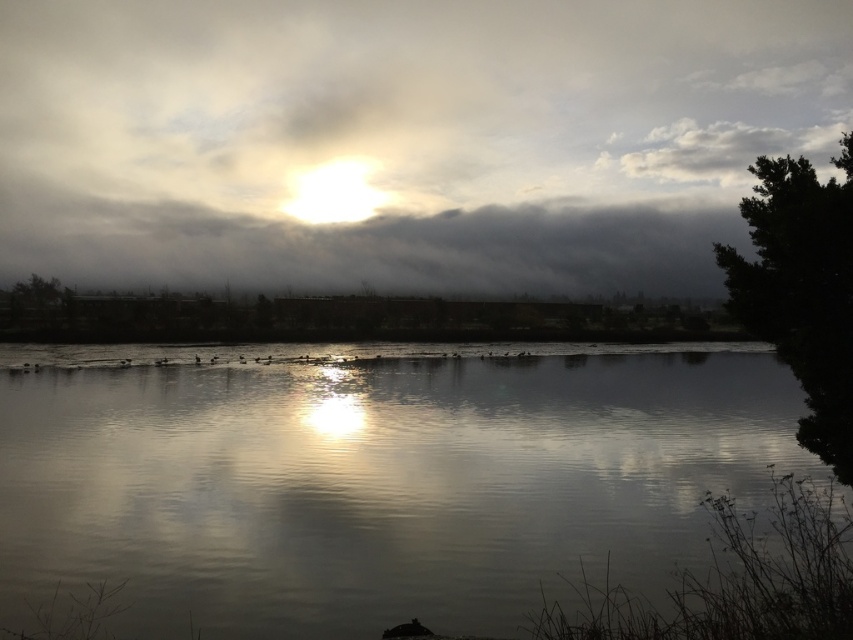
Who is shorter, dark green leafy tree at right or green leafy tree at left?

green leafy tree at left

Between dark green leafy tree at right and green leafy tree at left, which one appears on the left side from the viewer's perspective?

From the viewer's perspective, green leafy tree at left appears more on the left side.

Who is more distant from viewer, [817,280] or [65,305]?

Positioned behind is point [65,305].

Locate an element on the screen. Image resolution: width=853 pixels, height=640 pixels. dark green leafy tree at right is located at coordinates (802, 291).

Who is positioned more to the left, silvery reflective water at center or dark green leafy tree at right?

silvery reflective water at center is more to the left.

Who is shorter, silvery reflective water at center or dark green leafy tree at right?

silvery reflective water at center

I want to click on silvery reflective water at center, so coord(375,480).

Find the location of a particular element. silvery reflective water at center is located at coordinates 375,480.

Between point (88, 32) and point (38, 284), which one is positioned in front?

Point (38, 284)

The height and width of the screenshot is (640, 853). Describe the element at coordinates (403, 138) in the screenshot. I see `cloudy sky at upper center` at that location.

I want to click on cloudy sky at upper center, so [403, 138].